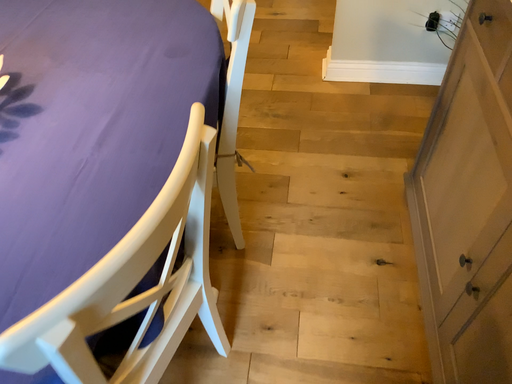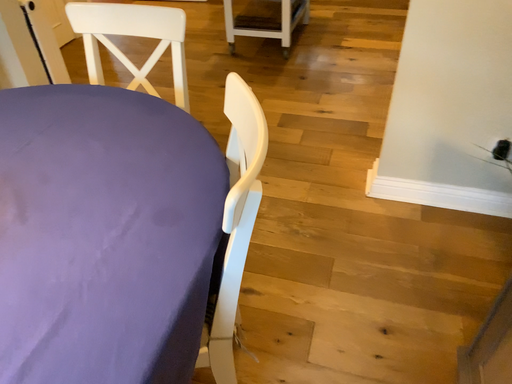
Question: Which way did the camera rotate in the video?

Choices:
 (A) rotated upward
 (B) rotated downward

Answer: (A)